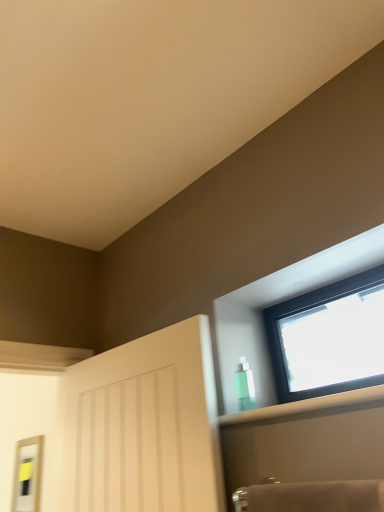
Question: Considering the relative sizes of matte silver mirror at left and green translucent bottle at upper right in the image provided, is matte silver mirror at left shorter than green translucent bottle at upper right?

Choices:
 (A) no
 (B) yes

Answer: (A)

Question: Is matte silver mirror at left not inside green translucent bottle at upper right?

Choices:
 (A) no
 (B) yes

Answer: (B)

Question: Can you confirm if matte silver mirror at left is bigger than green translucent bottle at upper right?

Choices:
 (A) yes
 (B) no

Answer: (A)

Question: Can you confirm if matte silver mirror at left is positioned to the left of green translucent bottle at upper right?

Choices:
 (A) yes
 (B) no

Answer: (A)

Question: Is matte silver mirror at left oriented towards green translucent bottle at upper right?

Choices:
 (A) no
 (B) yes

Answer: (A)

Question: From a real-world perspective, is matte silver mirror at left physically located above or below transparent plastic bottle at upper right?

Choices:
 (A) above
 (B) below

Answer: (B)

Question: Is matte silver mirror at left bigger or smaller than transparent plastic bottle at upper right?

Choices:
 (A) small
 (B) big

Answer: (A)

Question: In the image, is matte silver mirror at left positioned in front of or behind transparent plastic bottle at upper right?

Choices:
 (A) front
 (B) behind

Answer: (B)

Question: Is matte silver mirror at left inside or outside of transparent plastic bottle at upper right?

Choices:
 (A) inside
 (B) outside

Answer: (B)

Question: From the image's perspective, is matte silver mirror at left above or below transparent glass window at upper right?

Choices:
 (A) below
 (B) above

Answer: (A)

Question: Does point (34, 474) appear closer or farther from the camera than point (302, 385)?

Choices:
 (A) closer
 (B) farther

Answer: (B)

Question: From a real-world perspective, is matte silver mirror at left above or below transparent glass window at upper right?

Choices:
 (A) above
 (B) below

Answer: (B)

Question: Would you say matte silver mirror at left is to the left or to the right of transparent glass window at upper right in the picture?

Choices:
 (A) left
 (B) right

Answer: (A)

Question: Considering the positions of matte silver mirror at left and green translucent bottle at upper right in the image, is matte silver mirror at left taller or shorter than green translucent bottle at upper right?

Choices:
 (A) short
 (B) tall

Answer: (B)

Question: In the image, is matte silver mirror at left on the left side or the right side of green translucent bottle at upper right?

Choices:
 (A) right
 (B) left

Answer: (B)